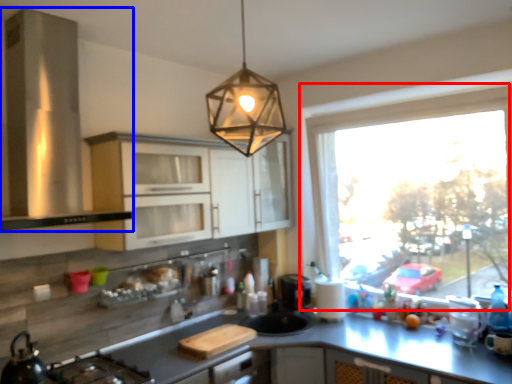
Question: Which point is further to the camera, window (highlighted by a red box) or kitchen appliance (highlighted by a blue box)?

Choices:
 (A) window
 (B) kitchen appliance

Answer: (A)